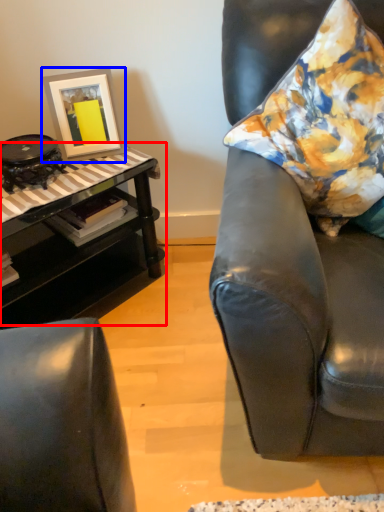
Question: Among these objects, which one is farthest to the camera, table (highlighted by a red box) or picture frame (highlighted by a blue box)?

Choices:
 (A) table
 (B) picture frame

Answer: (B)